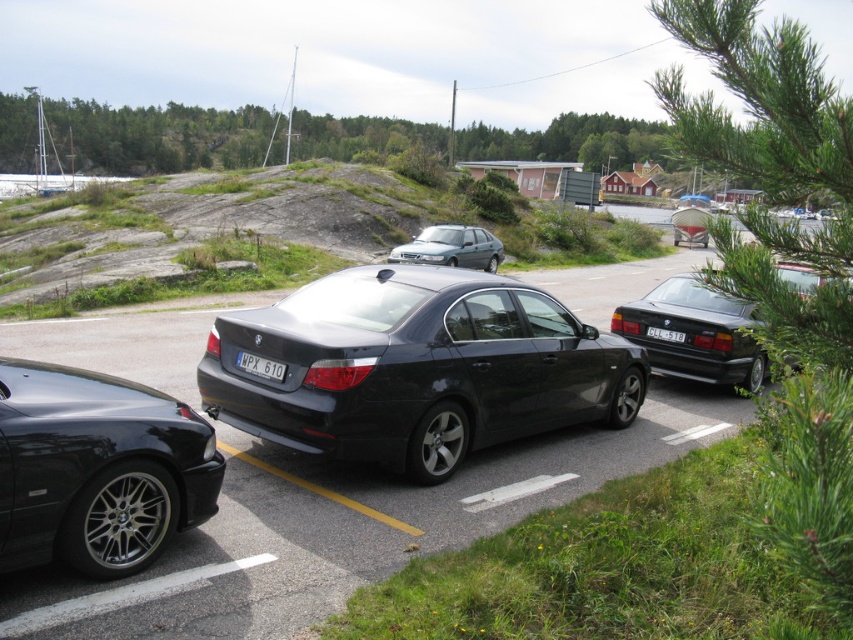
Question: Which point is farther from the camera taking this photo?

Choices:
 (A) pyautogui.click(x=473, y=246)
 (B) pyautogui.click(x=727, y=344)
 (C) pyautogui.click(x=550, y=387)

Answer: (A)

Question: Observing the image, what is the correct spatial positioning of glossy black car at center in reference to matte black sedan at center?

Choices:
 (A) below
 (B) above

Answer: (B)

Question: Which of the following is the closest to the observer?

Choices:
 (A) glossy black sedan at right
 (B) glossy black car at center
 (C) glossy black car at lower left
 (D) metallic gray hatchback at center

Answer: (C)

Question: Among these objects, which one is farthest from the camera?

Choices:
 (A) glossy black sedan at right
 (B) glossy black car at center
 (C) metallic gray hatchback at center
 (D) glossy black car at lower left

Answer: (C)

Question: Considering the relative positions of glossy black car at center and black plastic license plate at center in the image provided, where is glossy black car at center located with respect to black plastic license plate at center?

Choices:
 (A) left
 (B) right

Answer: (A)

Question: Is white matte license plate at center closer to camera compared to black plastic license plate at center?

Choices:
 (A) no
 (B) yes

Answer: (B)